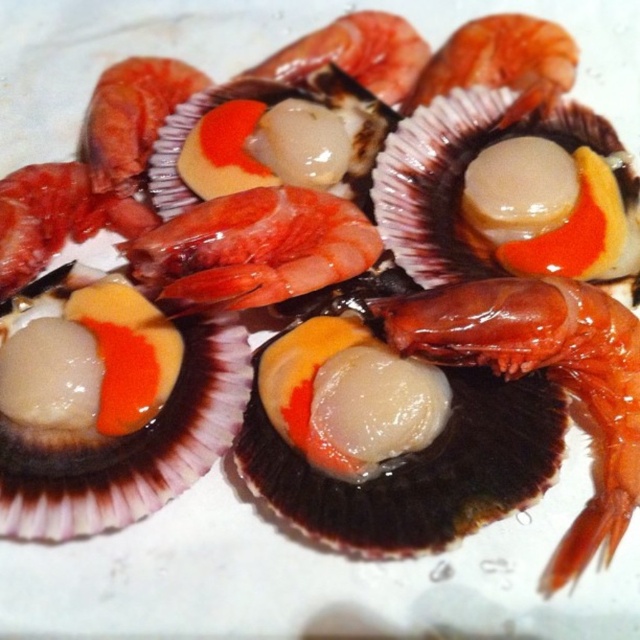
Question: Is the position of translucent glossy shrimp at upper center more distant than that of translucent gelatinous shrimp at upper center?

Choices:
 (A) no
 (B) yes

Answer: (B)

Question: Considering the real-world distances, which object is closest to the translucent gelatinous shrimp at upper left?

Choices:
 (A) translucent gelatinous shrimp at upper center
 (B) glossy orange shrimp at center
 (C) translucent gelatinous shrimp at center
 (D) translucent glossy shrimp at upper center

Answer: (A)

Question: Can you confirm if glossy orange shrimp at center is thinner than translucent glossy shrimp at upper center?

Choices:
 (A) yes
 (B) no

Answer: (B)

Question: Can you confirm if glossy orange shrimp at center is bigger than translucent gelatinous shrimp at center?

Choices:
 (A) no
 (B) yes

Answer: (B)

Question: Which is nearer to the translucent glossy shrimp at center?

Choices:
 (A) translucent gelatinous shrimp at upper left
 (B) translucent gelatinous shrimp at upper center
 (C) translucent glossy shrimp at upper center
 (D) translucent gelatinous shrimp at center

Answer: (A)

Question: Which point appears closest to the camera in this image?

Choices:
 (A) (609, 484)
 (B) (145, 275)

Answer: (A)